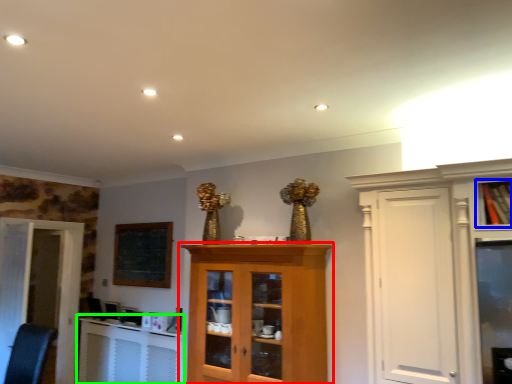
Question: Which object is positioned farthest from cupboard (highlighted by a red box)? Select from cabinetry (highlighted by a blue box) and table (highlighted by a green box).

Choices:
 (A) cabinetry
 (B) table

Answer: (A)